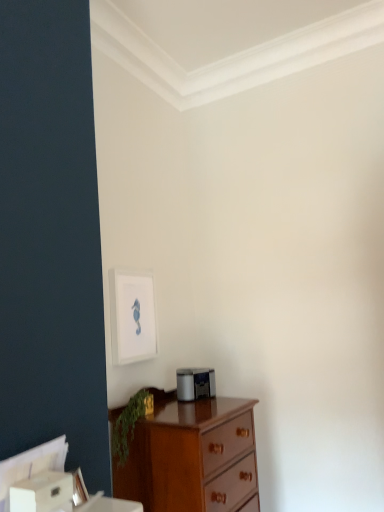
Question: From a real-world perspective, is wooden chest of drawers at lower left positioned above or below green leafy plant at lower left?

Choices:
 (A) above
 (B) below

Answer: (B)

Question: In terms of width, does wooden chest of drawers at lower left look wider or thinner when compared to green leafy plant at lower left?

Choices:
 (A) thin
 (B) wide

Answer: (B)

Question: Which object is positioned closest to the white matte picture frame at upper center?

Choices:
 (A) wooden chest of drawers at lower left
 (B) green leafy plant at lower left

Answer: (B)

Question: Based on their relative distances, which object is nearer to the white matte picture frame at upper center?

Choices:
 (A) green leafy plant at lower left
 (B) wooden chest of drawers at lower left

Answer: (A)